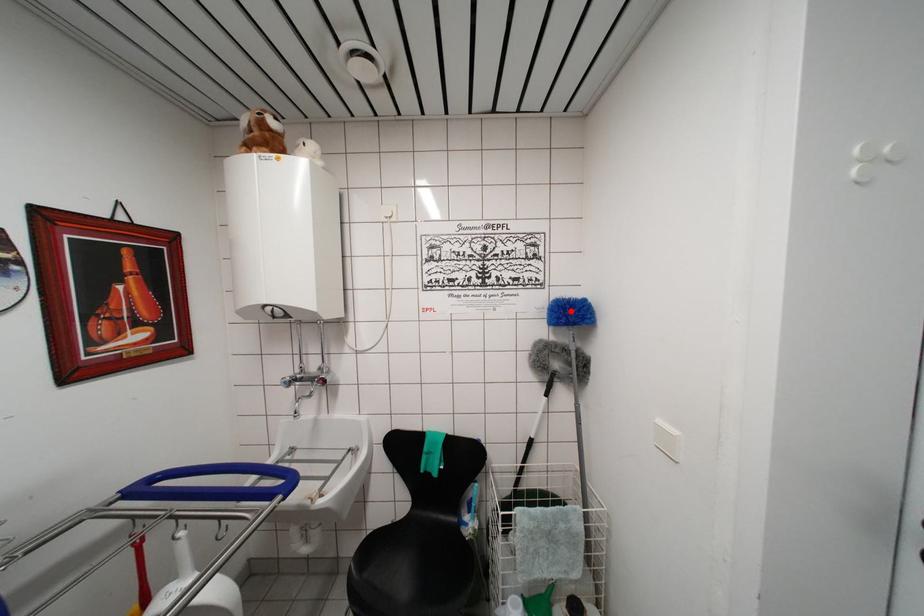
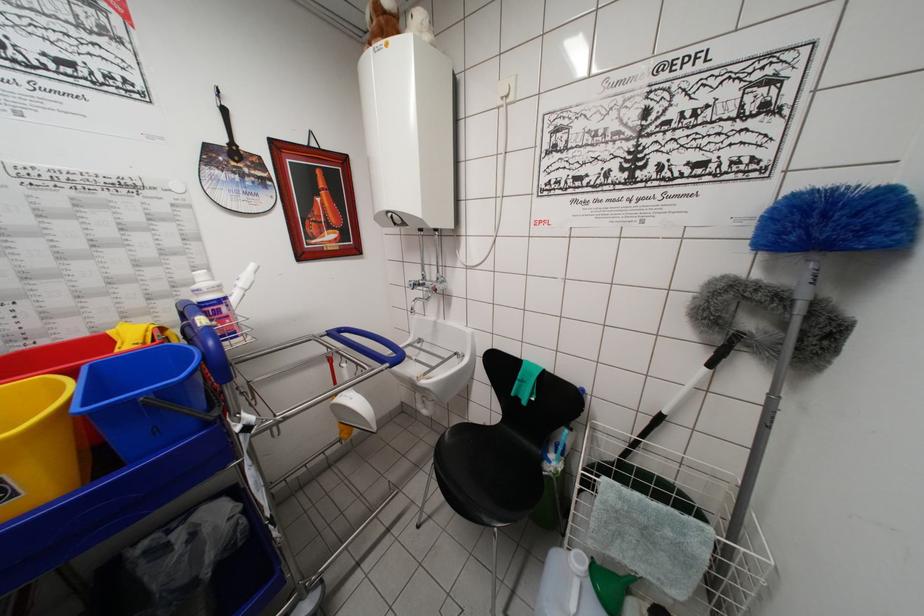
Find the pixel in the second image that matches the highlighted location in the first image.

(821, 209)